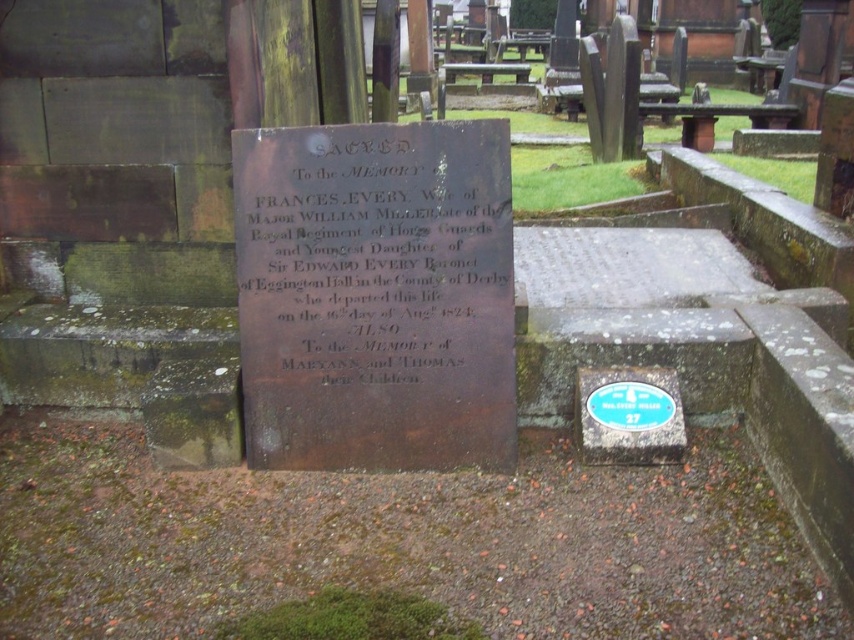
Based on the photo, what is the relationship between the height of the bronze plaque at center and the green painted metal sign at lower right?

The bronze plaque at center is much taller than the green painted metal sign at lower right.